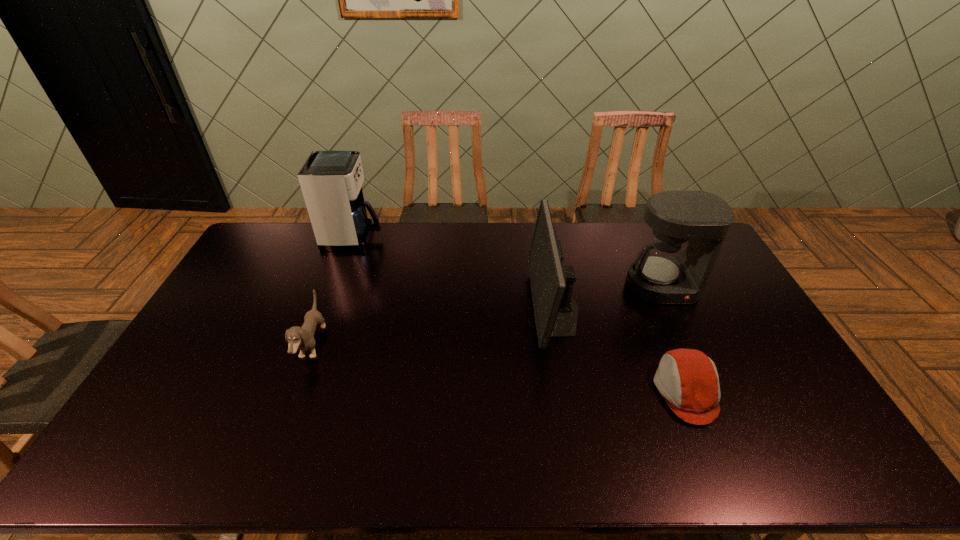
Identify the location of free space at the right edge of the desktop. The height and width of the screenshot is (540, 960). (756, 316).

Locate an element on the screen. The height and width of the screenshot is (540, 960). blank space at the far left corner is located at coordinates (266, 255).

Identify the location of vacant region between the puppy and the computer monitor. The width and height of the screenshot is (960, 540). (434, 327).

Locate an element on the screen. vacant region between the third object from right to left and the farther coffee maker is located at coordinates [454, 273].

Identify the location of free space between the computer monitor and the second shortest object. (434, 327).

Locate an element on the screen. This screenshot has width=960, height=540. vacant region between the cap and the third object from right to left is located at coordinates (620, 350).

Where is `unoccupied position between the cap and the puppy`? unoccupied position between the cap and the puppy is located at coordinates (499, 368).

Find the location of a particular element. This screenshot has width=960, height=540. vacant region between the puppy and the third object from right to left is located at coordinates (434, 327).

At what (x,y) coordinates should I click in order to perform the action: click on empty location between the shortest object and the farther coffee maker. Please return your answer as a coordinate pair (x, y). This screenshot has width=960, height=540. Looking at the image, I should click on (519, 314).

In order to click on unoccupied position between the computer monitor and the nearer coffee maker in this screenshot , I will do `click(609, 298)`.